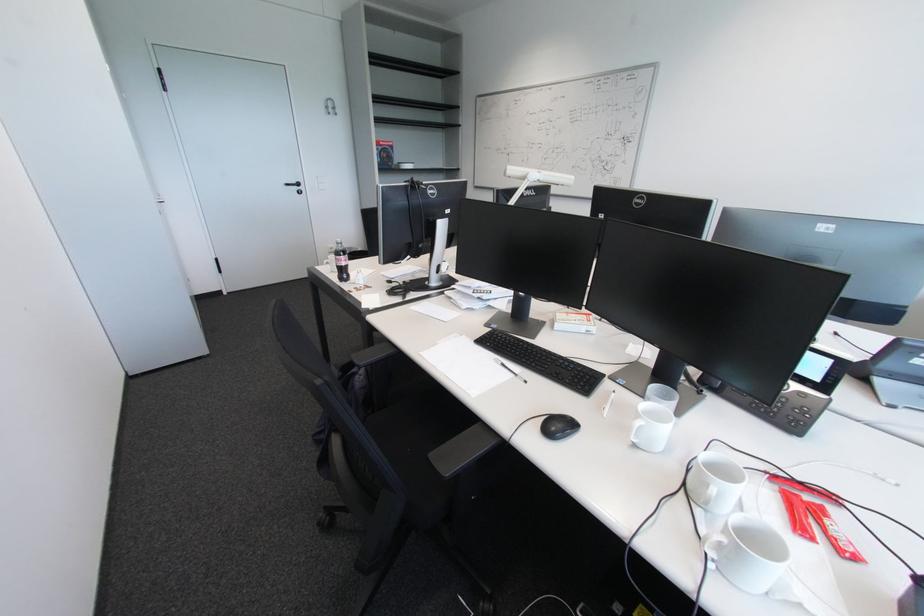
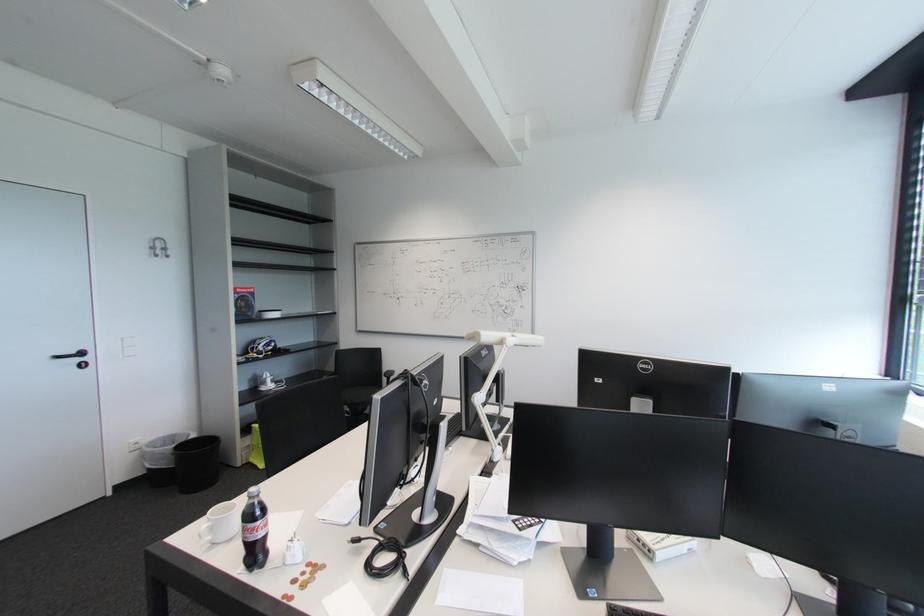
Find the pixel in the second image that matches the point at 304,190 in the first image.

(83, 361)